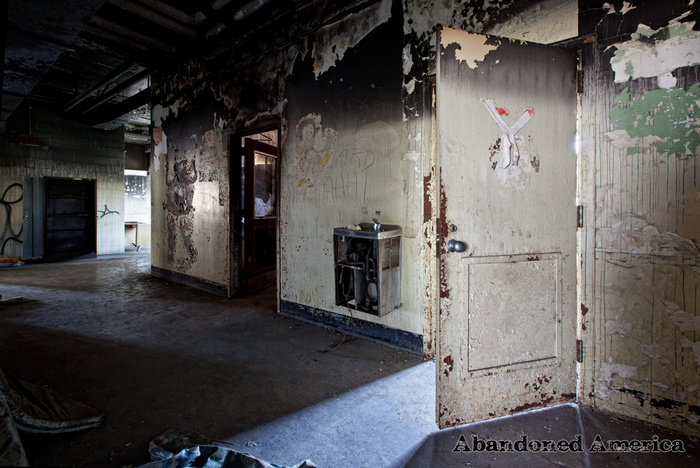
Identify the location of keyhole. The width and height of the screenshot is (700, 468). (452, 228).